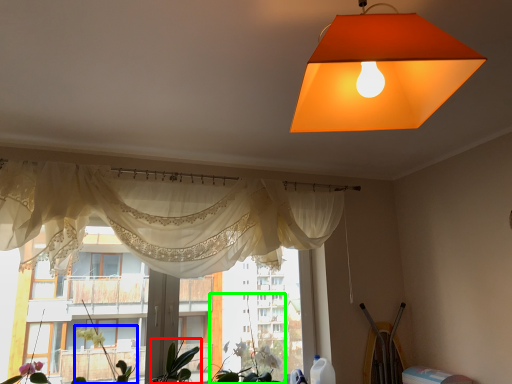
Question: Considering the real-world distances, which object is closest to plant (highlighted by a red box)? plant (highlighted by a blue box) or plant (highlighted by a green box).

Choices:
 (A) plant
 (B) plant

Answer: (A)